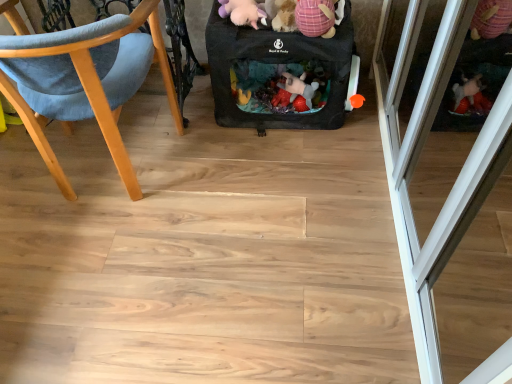
In order to click on vacant space in wooden chair at left (from a real-world perspective) in this screenshot , I will do `click(111, 173)`.